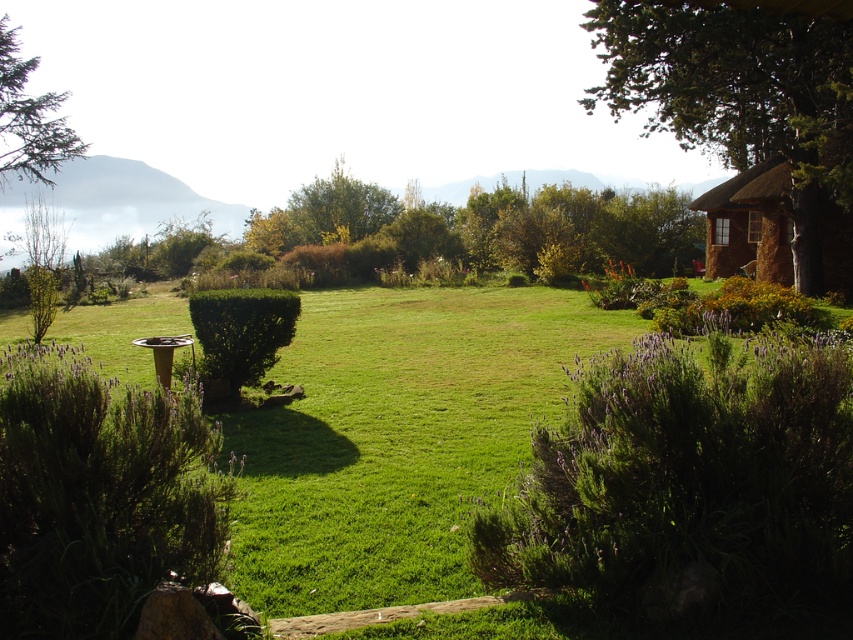
Question: Does green shrubbery at lower right have a greater width compared to brown thatched hut at right?

Choices:
 (A) no
 (B) yes

Answer: (A)

Question: Is brown thatched hut at right below green leafy hedge at center?

Choices:
 (A) no
 (B) yes

Answer: (A)

Question: Is green shrubbery at lower right bigger than brown thatched roof at right?

Choices:
 (A) yes
 (B) no

Answer: (B)

Question: Which of the following is the farthest from the observer?

Choices:
 (A) brown thatched roof at right
 (B) green leafy hedge at center
 (C) green shrubbery at lower right

Answer: (B)

Question: Which object is positioned farthest from the brown thatched hut at right?

Choices:
 (A) green shrubbery at lower right
 (B) green leafy hedge at center-left

Answer: (B)

Question: Which object is the farthest from the brown thatched roof at right?

Choices:
 (A) green leafy hedge at center
 (B) green needle-like tree at upper left
 (C) green shrubbery at lower right
 (D) brown thatched hut at right

Answer: (B)